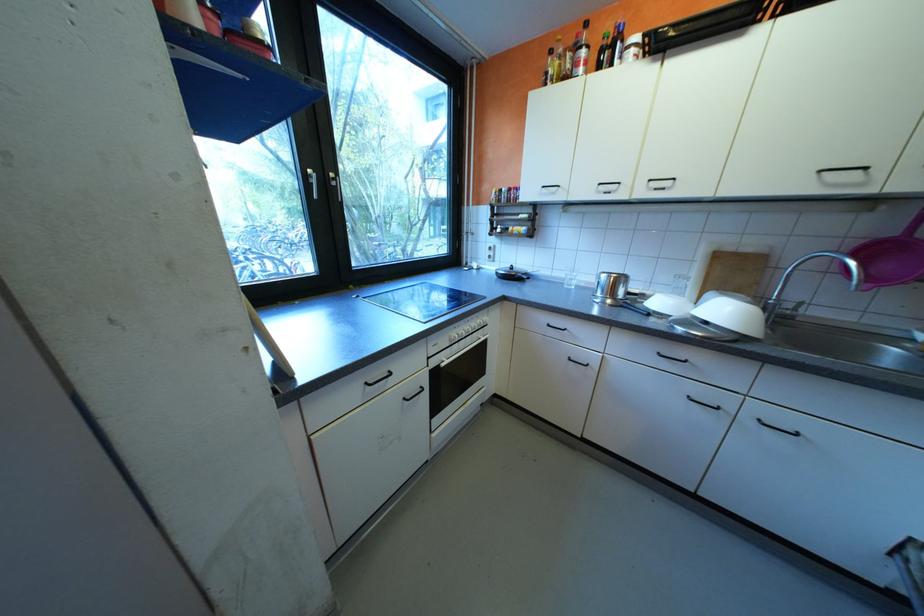
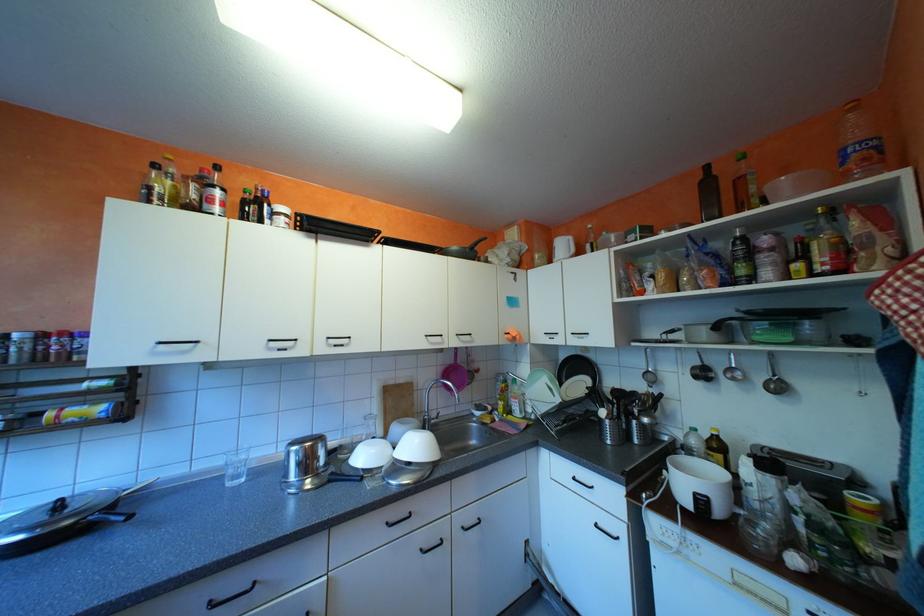
Find the pixel in the second image that matches [617,54] in the first image.

(263, 208)